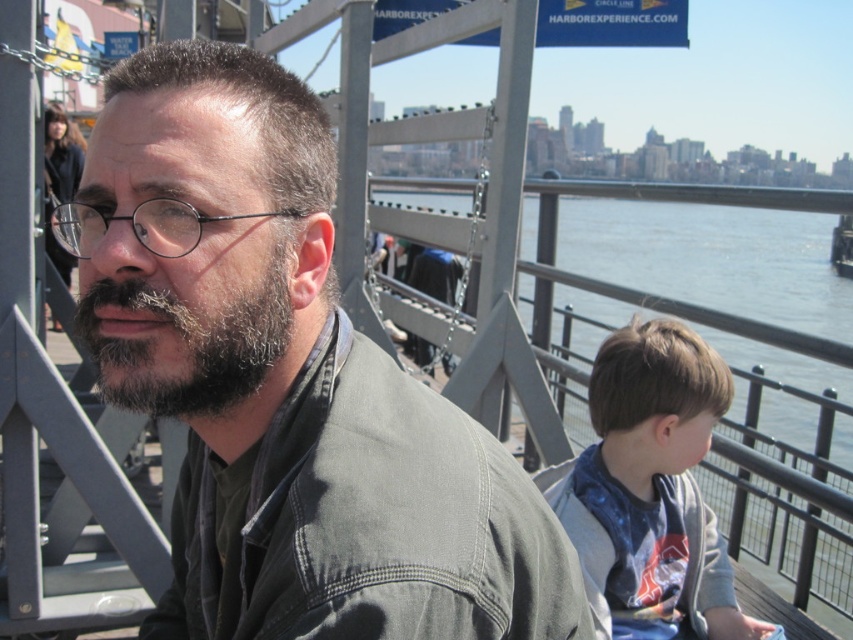
What is located at the coordinates point [286,381]?

The matte gray jacket at center is located at point [286,381].

You are a delivery drone with a wingspan of 1.5 meters. You need to fly from the blue water at center to the light brown hair at right. Is there enough space between them for your wingspan?

The distance between blue water at center and light brown hair at right is 4.86 meters, which is more than enough for the drone with a 1.5 meter wingspan to fly through safely.